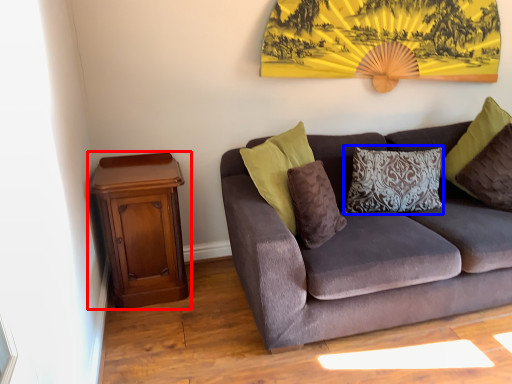
Question: Which of the following is the closest to the observer, nightstand (highlighted by a red box) or pillow (highlighted by a blue box)?

Choices:
 (A) nightstand
 (B) pillow

Answer: (A)